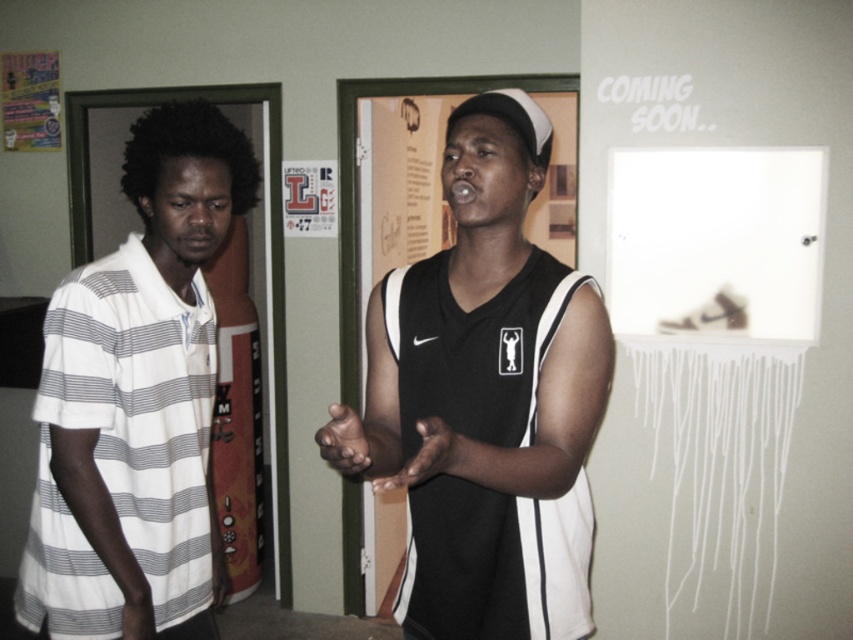
Looking at this image, you are a delivery robot that needs to place a package between the white striped polo shirt at left and the smooth skin hand at center. The package is 24 inches long. Will it fit in the space between them?

The distance between the white striped polo shirt at left and the smooth skin hand at center is 23.85 inches. Since the package is 24 inches long, it will not fit in the space between them.

You are a photographer trying to capture a closeup of both hands in the image. The dark skin hand at center and the smooth skin hand at lower left are both visible. Based on their positions, which hand should you focus on first to ensure both are in frame?

The dark skin hand at center is to the right of the smooth skin hand at lower left, so you should focus on the smooth skin hand at lower left first to ensure both hands are within the frame.